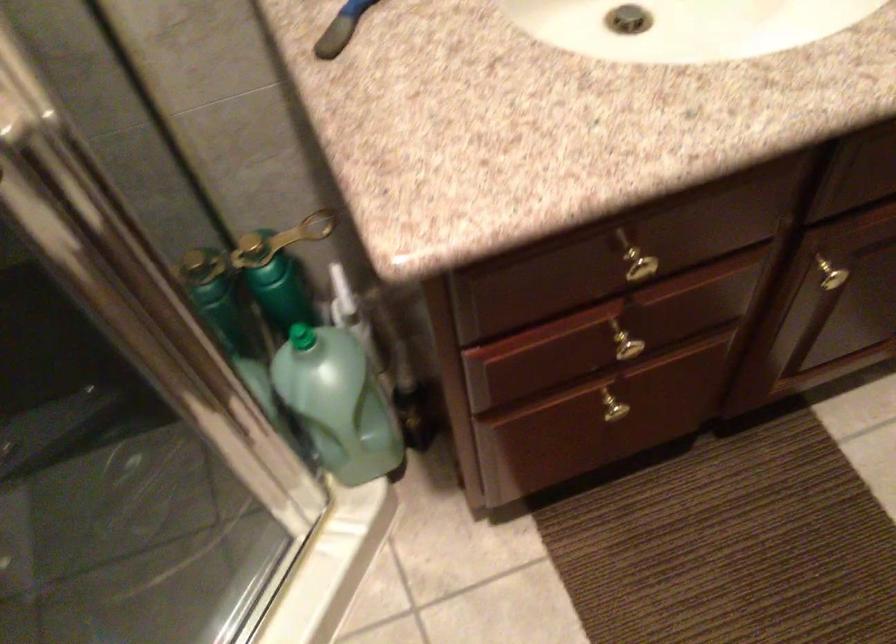
Find where to pull the brass cabinet knob. Please return your answer as a coordinate pair (x, y).

(830, 272)